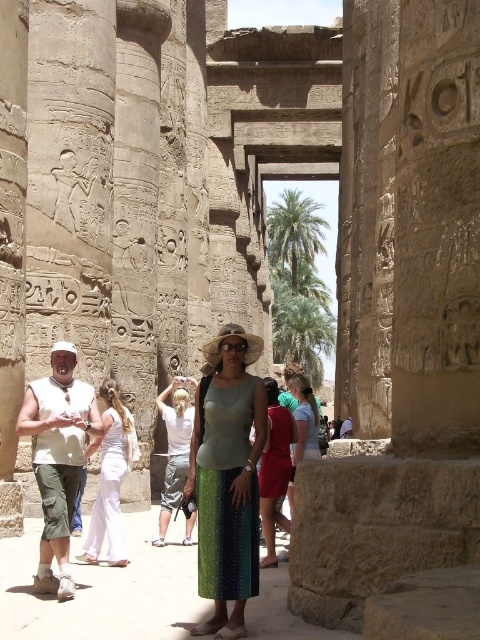
Question: Is green textured skirt at center thinner than white cotton vest at left?

Choices:
 (A) yes
 (B) no

Answer: (A)

Question: Which point is closer to the camera?

Choices:
 (A) green textured dress at center
 (B) white cotton dress at left

Answer: (A)

Question: Can you confirm if green textured dress at center is thinner than white cotton shirt at center?

Choices:
 (A) yes
 (B) no

Answer: (A)

Question: Which point is farther to the camera?

Choices:
 (A) white cotton dress at left
 (B) white cotton shirt at center
 (C) green textured skirt at center

Answer: (B)

Question: Which point is closer to the camera?

Choices:
 (A) (203, 500)
 (B) (50, 392)
 (C) (186, 406)

Answer: (A)

Question: From the image, what is the correct spatial relationship of white cotton dress at left in relation to white cotton shirt at center?

Choices:
 (A) left
 (B) right

Answer: (A)